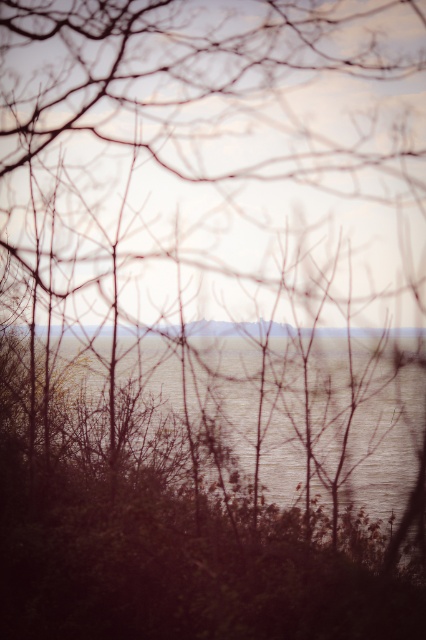
You are standing in a landscape scene with bare tree branches in the foreground. You notice a point marked at coordinates (x=172, y=465). What is located at that point?

The point at coordinates (x=172, y=465) marks silvery reflective water at center.

You are an artist trying to paint the scene. You want to place the silvery reflective water at center in your painting. According to the image, where should you position it in terms of coordinates?

The silvery reflective water at center should be positioned at coordinates point (172, 465).